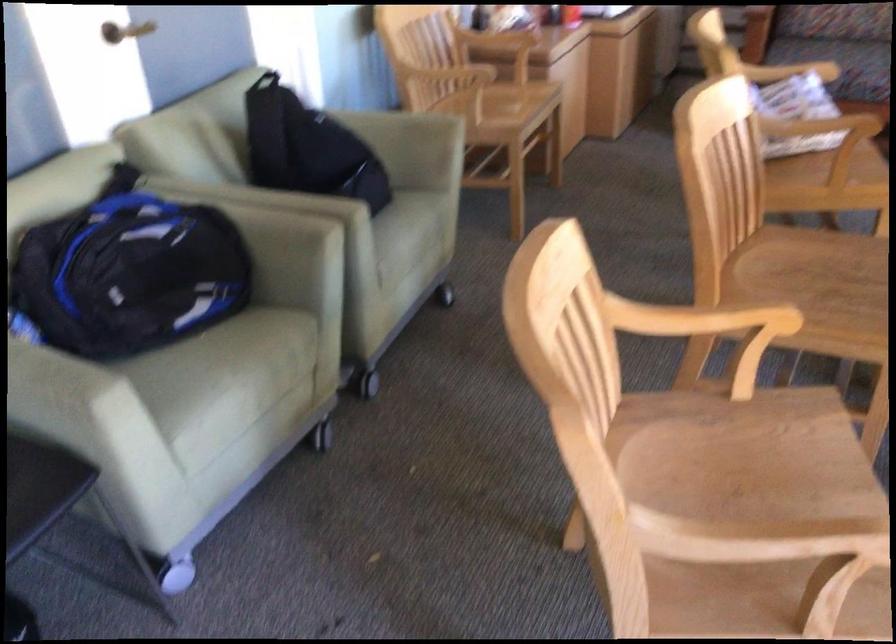
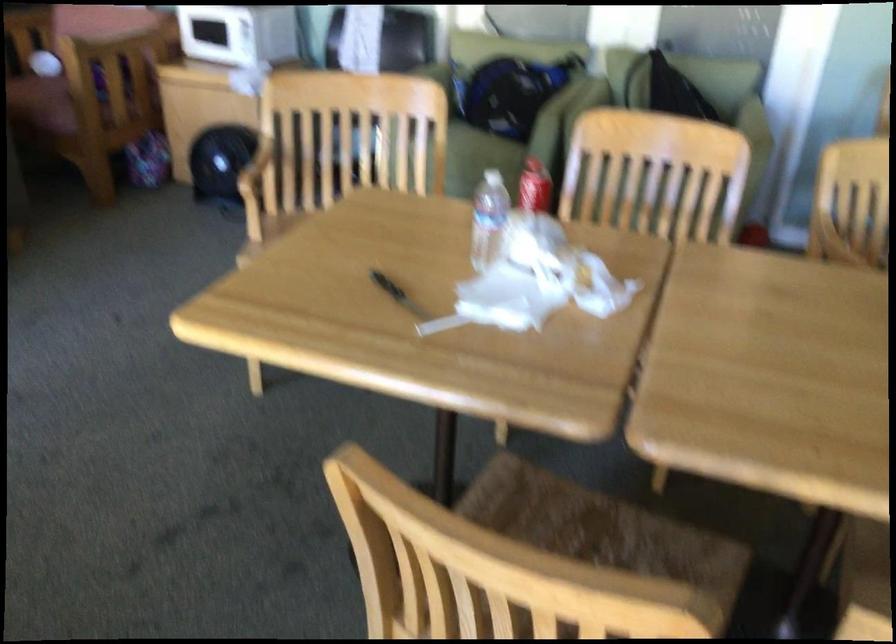
Question: I am providing you with two images of the same scene from different viewpoints. After the viewpoint changes to image2, which objects are now occluded?

Choices:
 (A) sofa sitting surface
 (B) yellow plastic tool
 (C) chair armrest
 (D) black handle knife

Answer: (A)